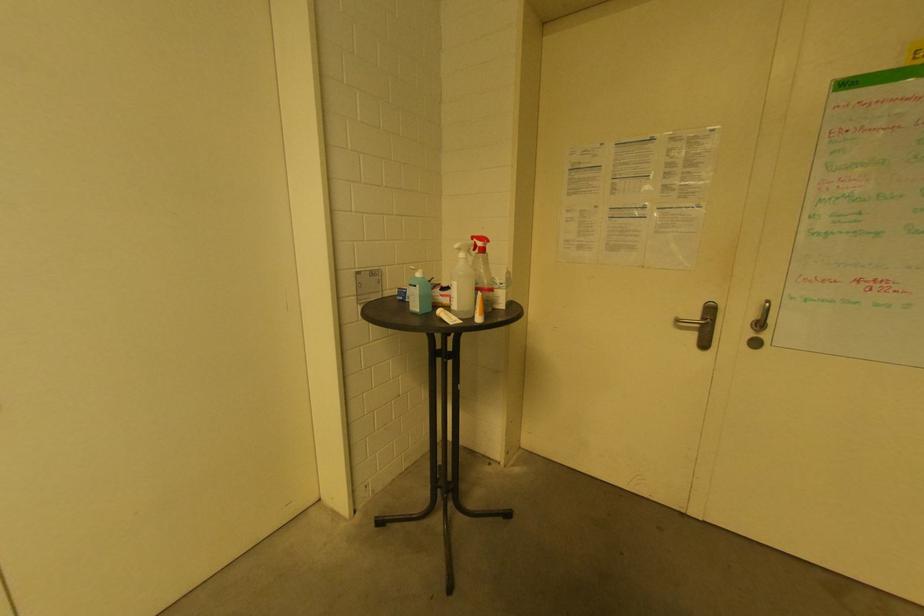
Where would you push the green pump dispenser? Please return your answer as a coordinate pair (x, y).

(421, 288)